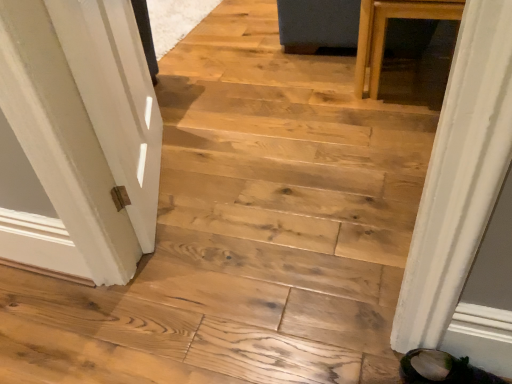
You are a GUI agent. You are given a task and a screenshot of the screen. Output one action in this format:
    pyautogui.click(x=<x>, y=<y>)
    Task: Click on the white painted wood door at left
    The height and width of the screenshot is (384, 512).
    Given the screenshot: What is the action you would take?
    pyautogui.click(x=81, y=135)

This screenshot has width=512, height=384. What do you see at coordinates (81, 135) in the screenshot?
I see `white painted wood door at left` at bounding box center [81, 135].

Find the location of `green suede shoe at lower right`. green suede shoe at lower right is located at coordinates (442, 369).

The height and width of the screenshot is (384, 512). Describe the element at coordinates (442, 369) in the screenshot. I see `green suede shoe at lower right` at that location.

Find the location of a particular element. The image size is (512, 384). white painted wood door at left is located at coordinates (81, 135).

Is white painted wood door at left at the right side of green suede shoe at lower right?

No.

Is white painted wood door at left positioned in front of green suede shoe at lower right?

No, it is behind green suede shoe at lower right.

Which is in front, point (156, 188) or point (444, 383)?

The point (444, 383) is in front.

From the image's perspective, relative to green suede shoe at lower right, is white painted wood door at left above or below?

white painted wood door at left is situated higher than green suede shoe at lower right in the image.

From a real-world perspective, is white painted wood door at left physically located above or below green suede shoe at lower right?

Clearly, from a real-world perspective, white painted wood door at left is above green suede shoe at lower right.

Can you confirm if white painted wood door at left is thinner than green suede shoe at lower right?

Yes.

Who is taller, white painted wood door at left or green suede shoe at lower right?

Standing taller between the two is white painted wood door at left.

Which of these two, white painted wood door at left or green suede shoe at lower right, is bigger?

white painted wood door at left.

Is white painted wood door at left outside of green suede shoe at lower right?

That's correct, white painted wood door at left is outside of green suede shoe at lower right.

Are white painted wood door at left and green suede shoe at lower right located far from each other?

Yes, white painted wood door at left and green suede shoe at lower right are located far from each other.

Does white painted wood door at left turn towards green suede shoe at lower right?

No, white painted wood door at left is not turned towards green suede shoe at lower right.

Can you tell me how much white painted wood door at left and green suede shoe at lower right differ in facing direction?

The angular difference between white painted wood door at left and green suede shoe at lower right is 153 degrees.

How much distance is there between white painted wood door at left and green suede shoe at lower right?

white painted wood door at left is 1.03 meters from green suede shoe at lower right.

Locate an element on the screen. Image resolution: width=512 pixels, height=384 pixels. footwear that appears below the white painted wood door at left (from the image's perspective) is located at coordinates (442, 369).

Which is more to the left, green suede shoe at lower right or white painted wood door at left?

white painted wood door at left.

Between green suede shoe at lower right and white painted wood door at left, which one is positioned in front?

green suede shoe at lower right.

Is point (469, 372) in front of point (14, 221)?

Yes, point (469, 372) is closer to viewer.

From the image's perspective, does green suede shoe at lower right appear lower than white painted wood door at left?

Yes, from the image's perspective, green suede shoe at lower right is beneath white painted wood door at left.

From a real-world perspective, is green suede shoe at lower right on top of white painted wood door at left?

No, from a real-world perspective, green suede shoe at lower right is not above white painted wood door at left.

Considering the relative sizes of green suede shoe at lower right and white painted wood door at left in the image provided, is green suede shoe at lower right wider than white painted wood door at left?

Yes.

Considering the relative sizes of green suede shoe at lower right and white painted wood door at left in the image provided, is green suede shoe at lower right shorter than white painted wood door at left?

Yes.

Based on the photo, who is smaller, green suede shoe at lower right or white painted wood door at left?

green suede shoe at lower right is smaller.

Based on the photo, choose the correct answer: Is green suede shoe at lower right inside white painted wood door at left or outside it?

green suede shoe at lower right is not inside white painted wood door at left, it's outside.

Is green suede shoe at lower right far from white painted wood door at left?

Yes, green suede shoe at lower right and white painted wood door at left are located far from each other.

Is green suede shoe at lower right oriented towards white painted wood door at left?

No, green suede shoe at lower right is not oriented towards white painted wood door at left.

I want to click on footwear located in front of the white painted wood door at left, so click(442, 369).

Find the location of a particular element. The image size is (512, 384). door behind the green suede shoe at lower right is located at coordinates (81, 135).

Locate an element on the screen. The image size is (512, 384). footwear located underneath the white painted wood door at left (from a real-world perspective) is located at coordinates (442, 369).